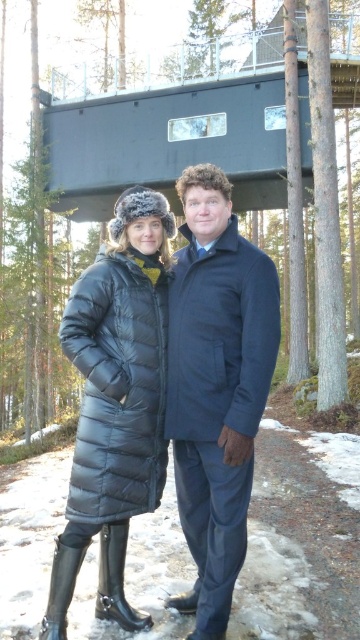
Based on the photo, you are planning to hang both the matte black coat at center and the dark blue wool coat at center on a standard coat rack. The coat rack has two hooks placed at different heights. The higher hook is 1.5 meters from the ground, and the lower one is 1.2 meters. Based on their sizes, which coat should be placed on which hook?

The matte black coat at center is taller than the dark blue wool coat at center. Therefore, the taller matte black coat at center should be placed on the higher hook at 1.5 meters, while the shorter dark blue wool coat at center should be placed on the lower hook at 1.2 meters to ensure proper hanging without dragging.

You are a delivery drone operator. Your drone is 2 meters wide and needs to fly through the space between the matte black coat at center and the viewer. Can the drone safely pass through this area?

The distance between the matte black coat at center and the viewer is 3.24 meters. Since the drone is 2 meters wide, it can safely pass through the space as the width is sufficient.

You are standing in the forest and see a point marked at coordinates (217, 387). Which object from the scene does this point lie on?

The point at coordinates (217, 387) lies on the matte black coat at center.